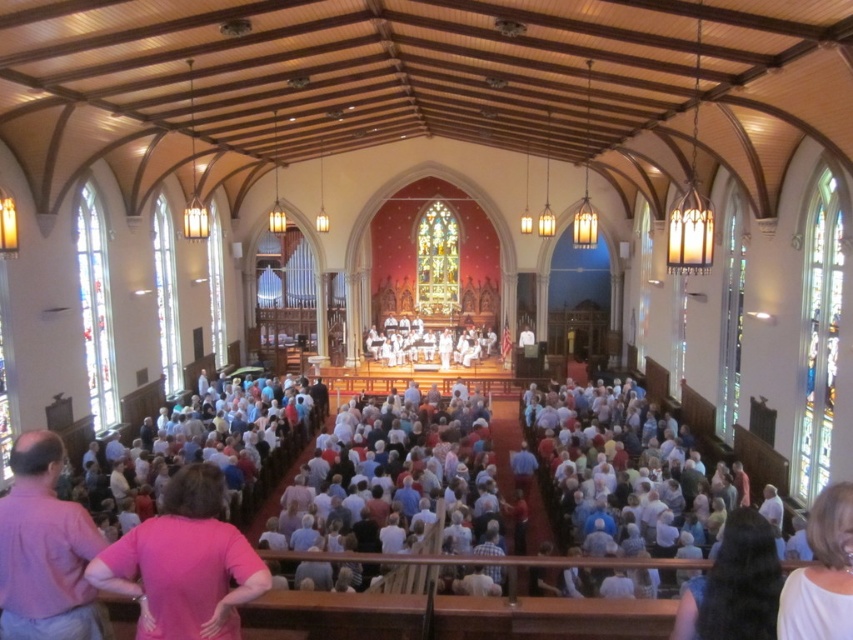
You are standing in the grand church and looking towards the stage. There are two points marked in the image, point 1 at coordinates point (77, 515) and point 2 at coordinates point (740, 621). Which point is closer to you?

Point (77, 515) is closer to you because it is further to the viewer than point (740, 621).